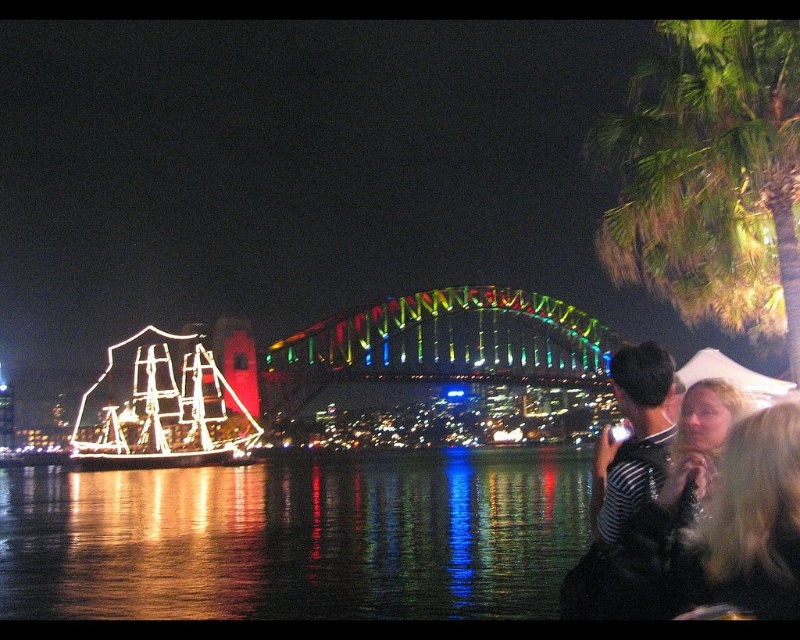
You are a tourist standing at the Sydney Harbour Bridge and see the glossy reflective water at center and the green leafy palm tree at upper right. Which object is closer to the water surface?

The glossy reflective water at center is below the green leafy palm tree at upper right, so the glossy reflective water at center is closer to the water surface.

You are standing at the point marked by the coordinates point (296,540) in the image. What is the most likely surface you are standing on?

The point (296,540) corresponds to the glossy reflective water at center, so you are standing on the glossy reflective water at center.

You are standing on the Sydney Harbour Bridge and want to take a photo of the striped fabric couple at right and the blonde hair at lower right in the same frame. Given that your camera has a 50mm lens, which has a field of view of approximately 46 degrees, can you fit both subjects into the frame without moving your position? Please consider their distance apart.

The striped fabric couple at right and blonde hair at lower right are 9.33 feet apart. With a 50mm lens having a 46 degree field of view, the maximum distance between two points that can be captured in the frame depends on the distance from the camera to the subjects. Since the exact distance from the camera to the subjects isn